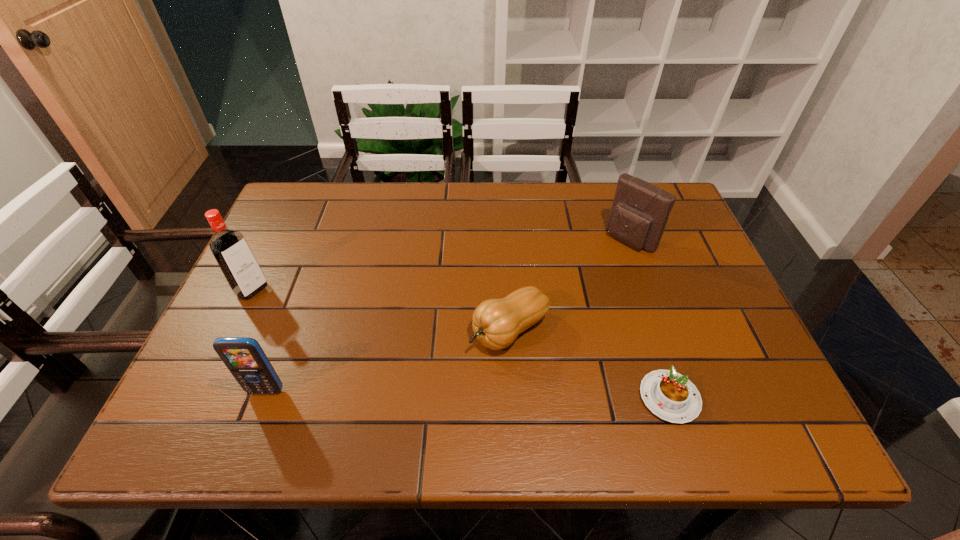
This screenshot has height=540, width=960. I want to click on vacant space located with an open flap on the pouch, so click(x=558, y=303).

The image size is (960, 540). I want to click on free space located 0.160m on the front and back of the fourth nearest object, so pos(308,325).

This screenshot has width=960, height=540. I want to click on vacant region located on the front and back of the fourth nearest object, so click(x=390, y=374).

Identify the location of vacant space located 0.050m on the front and back of the fourth nearest object. (276, 305).

The width and height of the screenshot is (960, 540). I want to click on vacant position located 0.070m on the stem side of the second shortest object, so click(452, 365).

This screenshot has height=540, width=960. What are the coordinates of `vacant space located on the stem side of the second shortest object` in the screenshot? It's located at (441, 373).

The height and width of the screenshot is (540, 960). What are the coordinates of `blank space located 0.120m on the stem side of the second shortest object` in the screenshot? It's located at (432, 377).

Where is `object at the far edge`? The height and width of the screenshot is (540, 960). object at the far edge is located at coordinates 640,210.

This screenshot has width=960, height=540. What are the coordinates of `cellular telephone at the near edge` in the screenshot? It's located at pos(245,359).

At what (x,y) coordinates should I click in order to perform the action: click on pudding present at the near edge. Please return your answer as a coordinate pair (x, y). The width and height of the screenshot is (960, 540). Looking at the image, I should click on (669, 395).